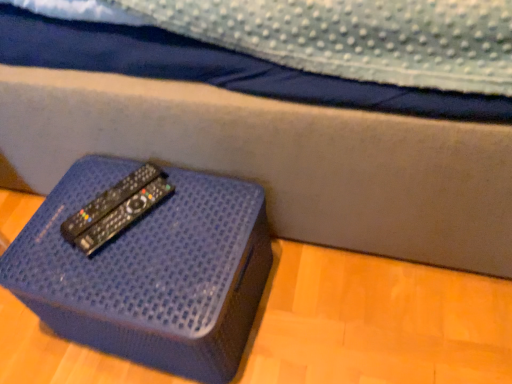
Find the location of a particular element. The height and width of the screenshot is (384, 512). vacant space in front of black plastic remote at center is located at coordinates (123, 271).